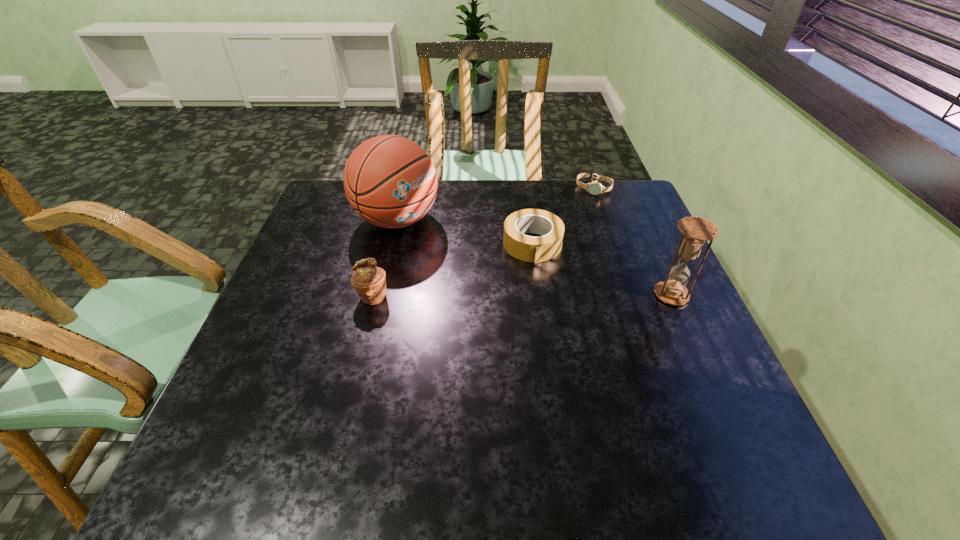
The height and width of the screenshot is (540, 960). In order to click on vacant space located 0.310m on the logo side of the tallest object in this screenshot , I will do [520, 278].

The width and height of the screenshot is (960, 540). Identify the location of vacant space located 0.320m on the face of the shortest object. (568, 256).

The width and height of the screenshot is (960, 540). I want to click on vacant space located 0.130m on the face of the shortest object, so click(582, 218).

Find the location of a particular element. free spot located on the face of the shortest object is located at coordinates (x=573, y=243).

Identify the location of free space located 0.390m at the edge of the duct tape. (565, 393).

This screenshot has width=960, height=540. Find the location of `vacant space situated at the edge of the duct tape`. vacant space situated at the edge of the duct tape is located at coordinates (557, 357).

The width and height of the screenshot is (960, 540). Find the location of `vacant area situated 0.340m at the edge of the duct tape`. vacant area situated 0.340m at the edge of the duct tape is located at coordinates (561, 372).

This screenshot has width=960, height=540. Identify the location of basketball present at the far edge. [390, 181].

You are a GUI agent. You are given a task and a screenshot of the screen. Output one action in this format:
    pyautogui.click(x=<x>, y=<y>)
    Task: Click on the watch present at the far edge
    
    Given the screenshot: What is the action you would take?
    pyautogui.click(x=595, y=188)

You are a GUI agent. You are given a task and a screenshot of the screen. Output one action in this format:
    pyautogui.click(x=<x>, y=<y>)
    Task: Click on the object that is positioned at the left edge
    
    Given the screenshot: What is the action you would take?
    pyautogui.click(x=390, y=181)